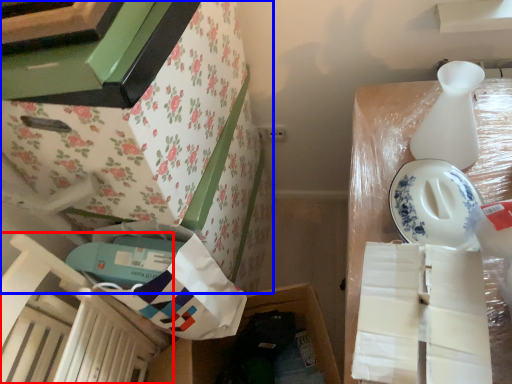
Question: Which object appears farthest to the camera in this image, chair (highlighted by a red box) or furniture (highlighted by a blue box)?

Choices:
 (A) chair
 (B) furniture

Answer: (B)